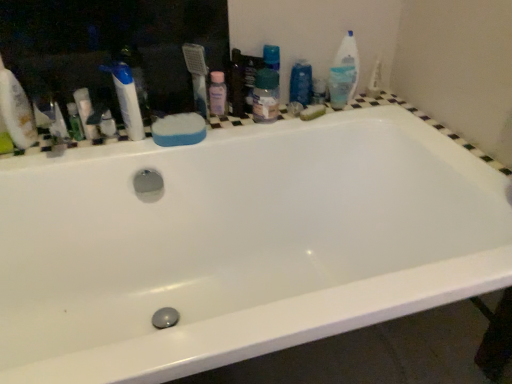
Question: From the image's perspective, relative to white glossy toothpaste at upper left, is white plastic medicine cabinet at upper left above or below?

Choices:
 (A) below
 (B) above

Answer: (B)

Question: Is white plastic medicine cabinet at upper left situated inside white glossy toothpaste at upper left or outside?

Choices:
 (A) outside
 (B) inside

Answer: (A)

Question: Which object is positioned farthest from the green plastic mouthwash at left?

Choices:
 (A) white plastic medicine cabinet at upper left
 (B) white plastic toothbrush at upper left, the fifth toiletry from the right
 (C) white glossy bathtub at upper center
 (D) translucent plastic container at upper center, the third toiletry positioned from the right
 (E) white glossy toothpaste at upper left

Answer: (C)

Question: Which object is the farthest from the green plastic mouthwash at left?

Choices:
 (A) white glossy bathtub at upper center
 (B) white plastic medicine cabinet at upper left
 (C) translucent plastic bottle at upper right, the 1th toiletry viewed from the right
 (D) blue sponge at upper left, which is counted as the 1th soap, starting from the left
 (E) white matte sponge at left, positioned as the second cleaning product in right-to-left order

Answer: (C)